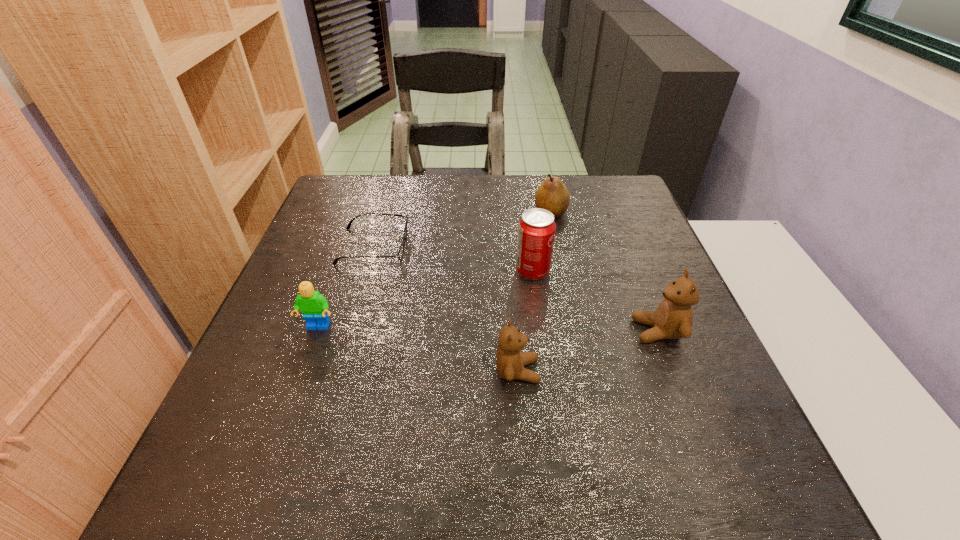
Image resolution: width=960 pixels, height=540 pixels. I want to click on blank area in the image that satisfies the following two spatial constraints: 1. on the front side of the pear; 2. on the front-facing side of the shortest object, so click(558, 246).

This screenshot has height=540, width=960. In order to click on free space that satisfies the following two spatial constraints: 1. on the front side of the soda; 2. on the front-facing side of the shorter teddy bear in this screenshot , I will do `click(546, 371)`.